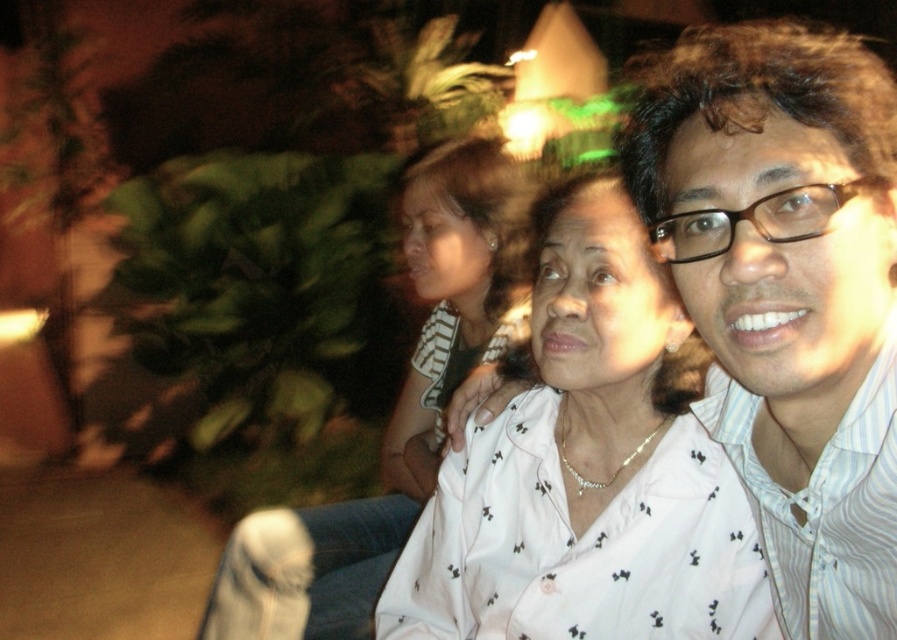
In the scene, there are two white clothing items visible. The first is a white printed blouse at center, and the second is a white striped shirt at right. Which of these two items is positioned higher up in the image?

The white printed blouse at center is taller than the white striped shirt at right, so it is positioned higher up in the image.